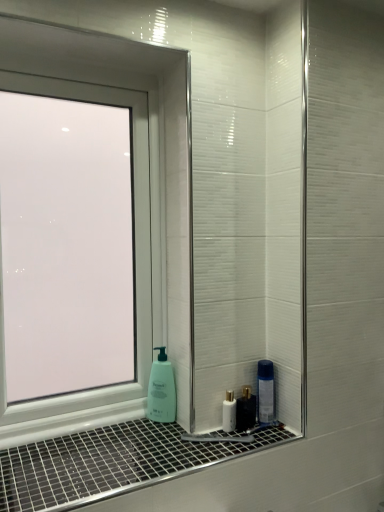
Question: Can you see green matte soap dispenser at lower center touching white glossy window sill at lower center?

Choices:
 (A) no
 (B) yes

Answer: (A)

Question: Can you confirm if green matte soap dispenser at lower center is smaller than white glossy window sill at lower center?

Choices:
 (A) yes
 (B) no

Answer: (A)

Question: Is green matte soap dispenser at lower center shorter than white glossy window sill at lower center?

Choices:
 (A) yes
 (B) no

Answer: (B)

Question: From the image's perspective, is green matte soap dispenser at lower center over white glossy window sill at lower center?

Choices:
 (A) no
 (B) yes

Answer: (B)

Question: Does green matte soap dispenser at lower center lie behind white glossy window sill at lower center?

Choices:
 (A) yes
 (B) no

Answer: (A)

Question: Can you confirm if green matte soap dispenser at lower center is taller than white glossy window sill at lower center?

Choices:
 (A) yes
 (B) no

Answer: (A)

Question: Can you confirm if white glossy mouthwash at lower center is shorter than white glossy window sill at lower center?

Choices:
 (A) yes
 (B) no

Answer: (B)

Question: From the image's perspective, is white glossy mouthwash at lower center beneath white glossy window sill at lower center?

Choices:
 (A) yes
 (B) no

Answer: (B)

Question: Does white glossy mouthwash at lower center have a lesser width compared to white glossy window sill at lower center?

Choices:
 (A) no
 (B) yes

Answer: (B)

Question: Is white glossy mouthwash at lower center aimed at white glossy window sill at lower center?

Choices:
 (A) yes
 (B) no

Answer: (B)

Question: From the image's perspective, does white glossy mouthwash at lower center appear higher than white glossy window sill at lower center?

Choices:
 (A) no
 (B) yes

Answer: (B)

Question: Is white glossy mouthwash at lower center closer to the viewer compared to white glossy window sill at lower center?

Choices:
 (A) yes
 (B) no

Answer: (B)

Question: Is transparent glass window at left at the right side of white glossy mouthwash at lower center?

Choices:
 (A) yes
 (B) no

Answer: (B)